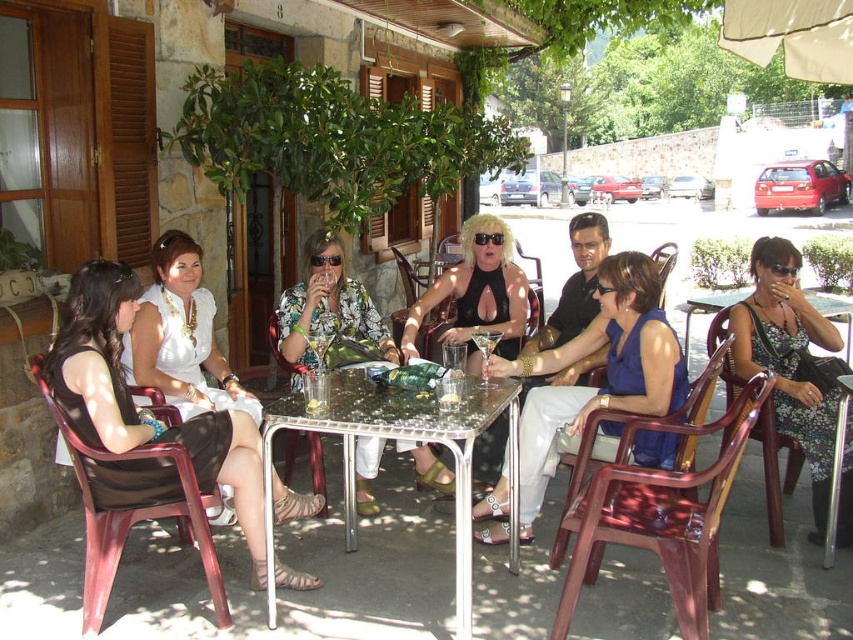
You are a photographer at the event and want to capture a photo of the black leather dress at center and the transparent plastic chair at lower left. Which object is shorter in height?

The black leather dress at center is shorter than the transparent plastic chair at lower left.